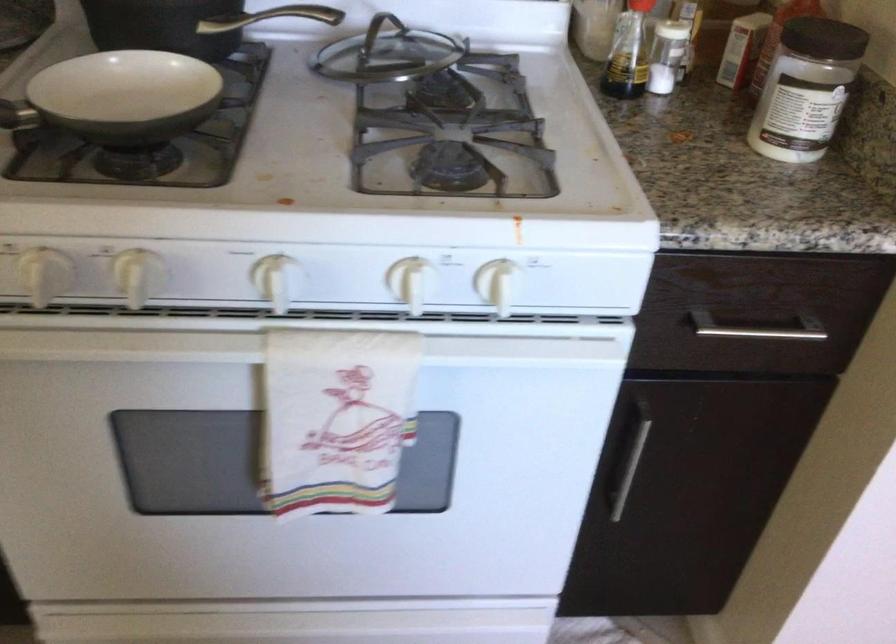
The images are taken continuously from a first-person perspective. In which direction is your viewpoint rotating?

The camera's rotation is toward right-down.